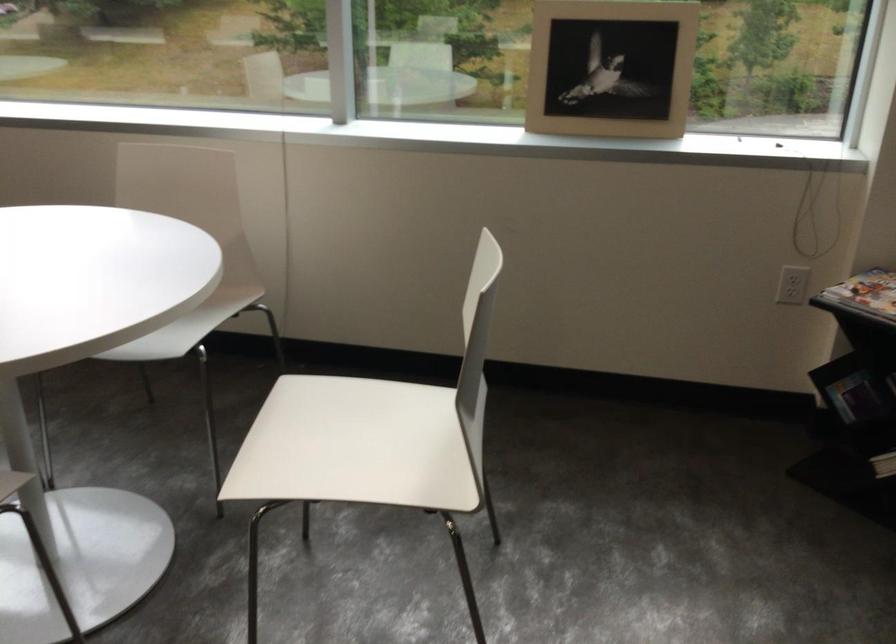
I want to click on picture frame, so click(609, 68).